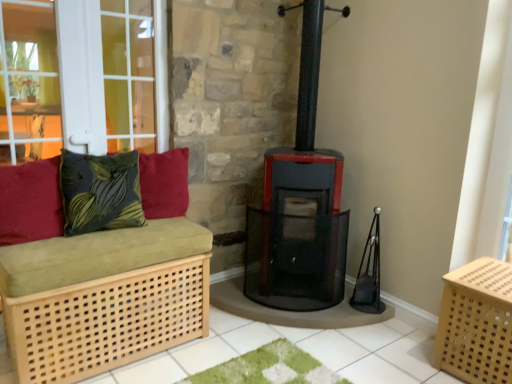
Question: Does light wood/canvassed crate at lower right have a greater width compared to green leafy fabric cushion at left, positioned as the 2th pillow in left-to-right order?

Choices:
 (A) no
 (B) yes

Answer: (B)

Question: From the image's perspective, is light wood/canvassed crate at lower right on green leafy fabric cushion at left, positioned as the 2th pillow in left-to-right order?

Choices:
 (A) no
 (B) yes

Answer: (A)

Question: From a real-world perspective, is light wood/canvassed crate at lower right physically above green leafy fabric cushion at left, positioned as the 2th pillow in left-to-right order?

Choices:
 (A) no
 (B) yes

Answer: (A)

Question: Is the position of light wood/canvassed crate at lower right less distant than that of green leafy fabric cushion at left, positioned as the 2th pillow in left-to-right order?

Choices:
 (A) no
 (B) yes

Answer: (B)

Question: From the image's perspective, is light wood/canvassed crate at lower right located beneath green leafy fabric cushion at left, positioned as the 2th pillow in left-to-right order?

Choices:
 (A) yes
 (B) no

Answer: (A)

Question: Considering the relative sizes of light wood/canvassed crate at lower right and green leafy fabric cushion at left, the 2th pillow when ordered from right to left, in the image provided, is light wood/canvassed crate at lower right smaller than green leafy fabric cushion at left, the 2th pillow when ordered from right to left,?

Choices:
 (A) yes
 (B) no

Answer: (B)

Question: Are velvety red cushion at upper left, positioned as the first pillow in right-to-left order, and light wood/light brown bench at left beside each other?

Choices:
 (A) yes
 (B) no

Answer: (B)

Question: Is the depth of velvety red cushion at upper left, which ranks as the third pillow in left-to-right order, greater than that of light wood/light brown bench at left?

Choices:
 (A) yes
 (B) no

Answer: (A)

Question: Is velvety red cushion at upper left, which ranks as the third pillow in left-to-right order, thinner than light wood/light brown bench at left?

Choices:
 (A) yes
 (B) no

Answer: (A)

Question: Would you say velvety red cushion at upper left, which ranks as the third pillow in left-to-right order, is outside light wood/light brown bench at left?

Choices:
 (A) yes
 (B) no

Answer: (A)

Question: Is velvety red cushion at upper left, positioned as the first pillow in right-to-left order, facing towards light wood/light brown bench at left?

Choices:
 (A) no
 (B) yes

Answer: (A)

Question: From the image's perspective, does velvety red cushion at upper left, positioned as the first pillow in right-to-left order, appear lower than light wood/light brown bench at left?

Choices:
 (A) yes
 (B) no

Answer: (B)

Question: Considering the relative sizes of green leafy fabric cushion at left, the 2th pillow when ordered from right to left, and velvety red cushion at upper left, which ranks as the third pillow in left-to-right order, in the image provided, is green leafy fabric cushion at left, the 2th pillow when ordered from right to left, smaller than velvety red cushion at upper left, which ranks as the third pillow in left-to-right order,?

Choices:
 (A) yes
 (B) no

Answer: (B)